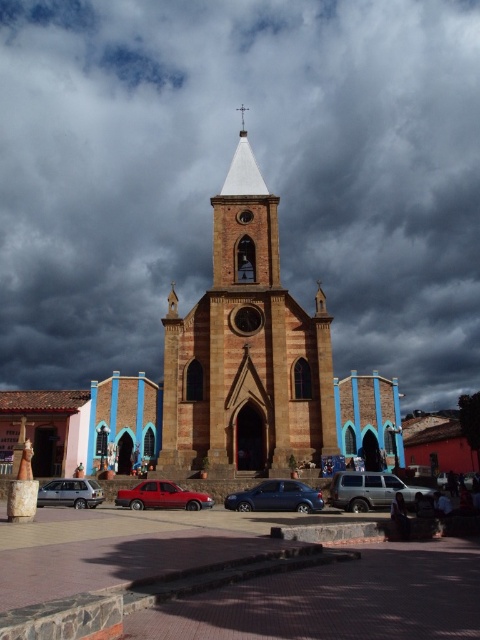
Question: Does dark cloudy sky at upper center have a larger size compared to brown stone tower at center?

Choices:
 (A) yes
 (B) no

Answer: (A)

Question: Considering the relative positions of brown stone tower at center and matte red sedan at center in the image provided, where is brown stone tower at center located with respect to matte red sedan at center?

Choices:
 (A) above
 (B) below

Answer: (A)

Question: Which object is farther from the camera taking this photo?

Choices:
 (A) brown stone tower at center
 (B) brick pavement at center
 (C) silver metallic suv at center

Answer: (A)

Question: Which of these objects is positioned farthest from the brick pavement at center?

Choices:
 (A) matte silver suv at lower left
 (B) brown stone tower at center
 (C) dark cloudy sky at upper center

Answer: (C)

Question: Is dark cloudy sky at upper center to the left of matte red sedan at center from the viewer's perspective?

Choices:
 (A) no
 (B) yes

Answer: (A)

Question: Which point is farther to the camera?

Choices:
 (A) (300, 484)
 (B) (276, 292)
 (C) (187, 506)

Answer: (B)